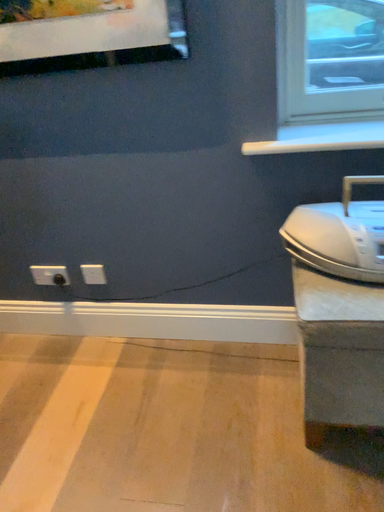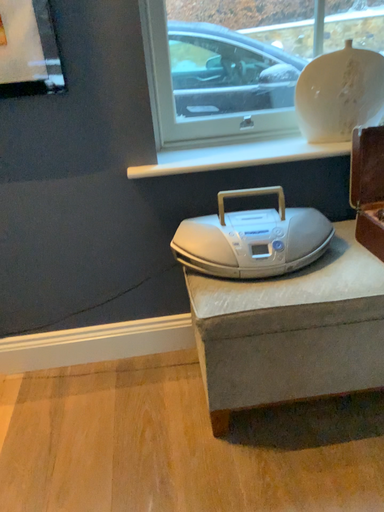
Question: How did the camera likely rotate when shooting the video?

Choices:
 (A) rotated left
 (B) rotated right

Answer: (B)